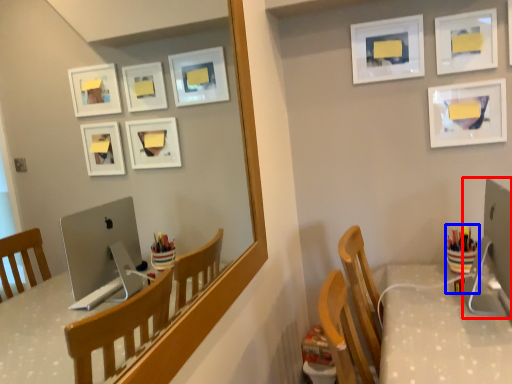
Question: Which object appears closest to the camera in this image, desktop computer (highlighted by a red box) or stationery (highlighted by a blue box)?

Choices:
 (A) desktop computer
 (B) stationery

Answer: (A)